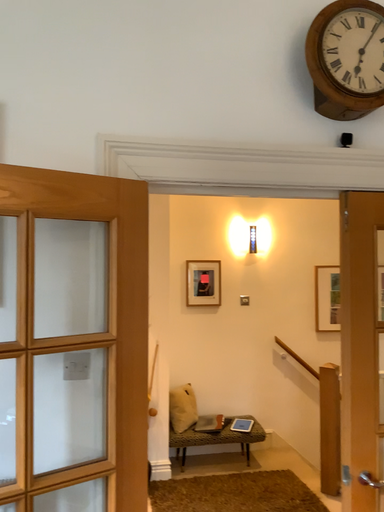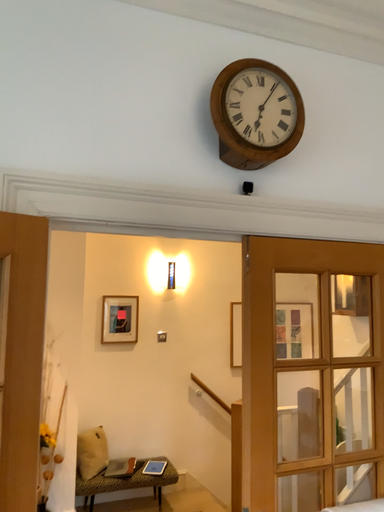
Question: How did the camera likely rotate when shooting the video?

Choices:
 (A) rotated right
 (B) rotated left

Answer: (A)